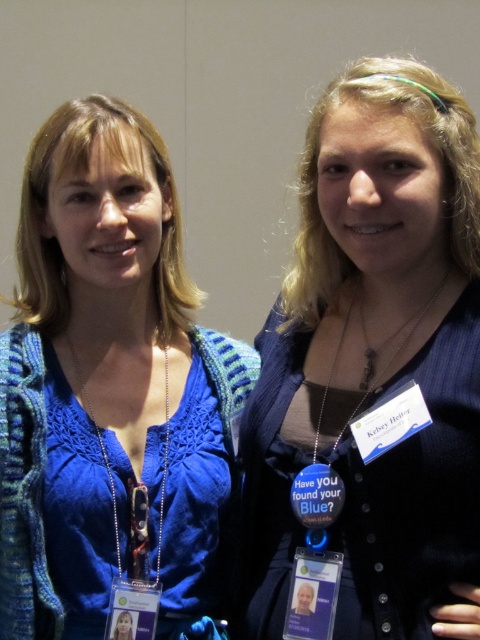
You are at a conference and need to hand your business card to the person wearing the matte blue sweater at center. You have a card that is 9 centimeters long. Can you fit the card into the blue fabric lanyard at center without bending it?

The matte blue sweater at center is 36.90 centimeters away from the blue fabric lanyard at center. Since the card is only 9 centimeters long, it can easily fit into the lanyard without bending.

You are standing in front of two people at an event. You need to hand a document to the person at point (434,620). If you are 5 feet tall, can you reach that point to hand them the document?

The distance between you and the point (434,620) is 3.29 feet. Since you are 5 feet tall, you can likely reach that point to hand the document as the distance is within a typical reaching range.

You are organizing a photo shoot and need to ensure that the matte blue sweater at center is visible in the final image. Given that the blue fabric lanyard at center is currently blocking part of it, how can you adjust the positioning of the lanyard to make the sweater fully visible?

The matte blue sweater at center is positioned under the blue fabric lanyard at center. To make the sweater fully visible, you can move the blue fabric lanyard at center upwards or to the side so it no longer covers the sweater.